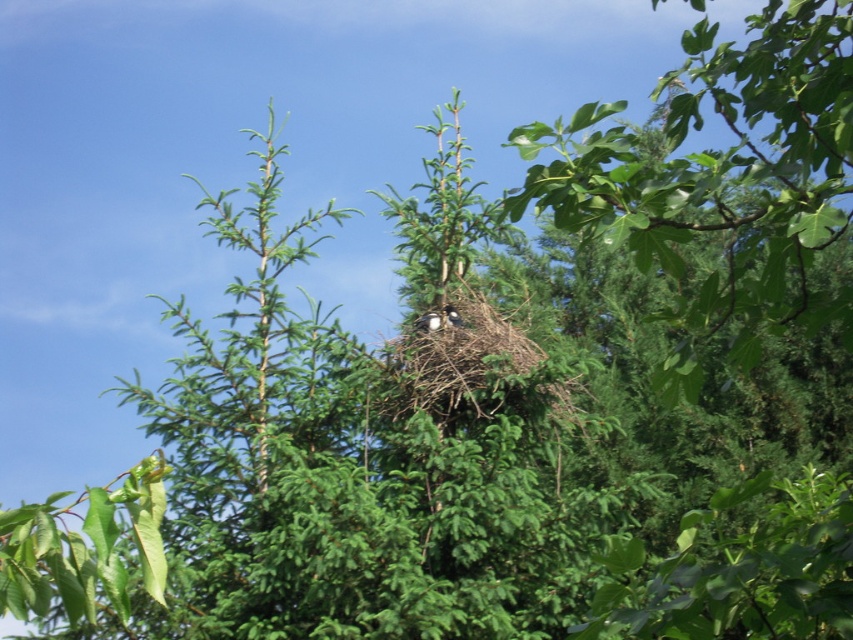
You are a nature photographer observing a tree with a nest. You notice two birds in the nest, a white fluffy bird at center and a brown fuzzy bird at center. Which bird is larger?

The brown fuzzy bird at center is larger than the white fluffy bird at center.

You are standing in front of a tree and looking at the center of the image. What do you see at the point with coordinates (428, 321)?

At the point with coordinates (428, 321), you see a white fluffy bird at center.